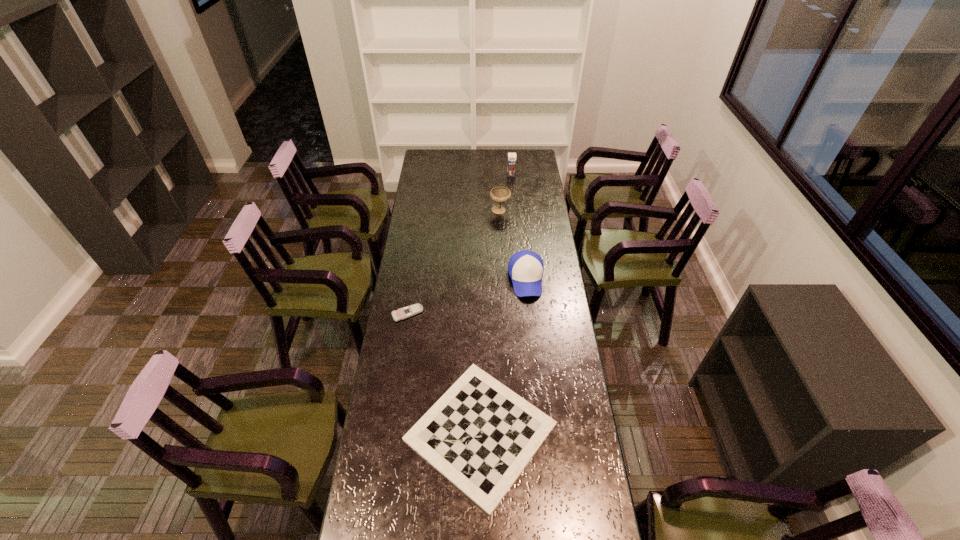
This screenshot has height=540, width=960. Find the location of `chocolate milk`. chocolate milk is located at coordinates (511, 166).

The width and height of the screenshot is (960, 540). Find the location of `the fourth nearest object`. the fourth nearest object is located at coordinates (500, 195).

Find the location of a particular element. This screenshot has height=540, width=960. baseball cap is located at coordinates (525, 267).

Locate an element on the screen. The width and height of the screenshot is (960, 540). the fourth farthest object is located at coordinates (403, 313).

You are a GUI agent. You are given a task and a screenshot of the screen. Output one action in this format:
    pyautogui.click(x=<x>, y=<y>)
    Task: Click on the nearest object
    This screenshot has width=960, height=540.
    Given the screenshot: What is the action you would take?
    pyautogui.click(x=480, y=435)

Image resolution: width=960 pixels, height=540 pixels. What are the coordinates of `free space located 0.220m on the front label of the chocolate milk` in the screenshot? It's located at (514, 198).

Where is `vacant area situated on the left of the second farthest object`? The image size is (960, 540). vacant area situated on the left of the second farthest object is located at coordinates (418, 211).

What are the coordinates of `free space located 0.100m on the front-facing side of the third farthest object` in the screenshot? It's located at (530, 318).

At what (x,y) coordinates should I click in order to perform the action: click on free location located on the front of the second nearest object. Please return your answer as a coordinate pair (x, y). Looking at the image, I should click on (396, 389).

Find the location of `vacant space positioned on the back of the nearest object`. vacant space positioned on the back of the nearest object is located at coordinates (480, 295).